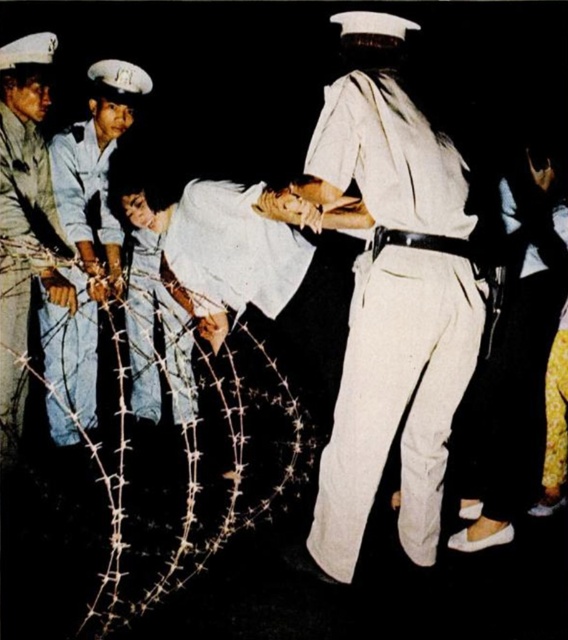
Who is taller, blue denim jeans at left or black leather belt at center?

blue denim jeans at left

Between blue denim jeans at left and black leather belt at center, which one appears on the left side from the viewer's perspective?

blue denim jeans at left

Measure the distance between point (48, 408) and camera.

Point (48, 408) and camera are 13.64 feet apart from each other.

You are a GUI agent. You are given a task and a screenshot of the screen. Output one action in this format:
    pyautogui.click(x=<x>, y=<y>)
    Task: Click on the blue denim jeans at left
    Image resolution: width=568 pixels, height=640 pixels.
    Given the screenshot: What is the action you would take?
    pyautogui.click(x=86, y=243)

Based on the photo, is white cotton uniform at center taller than blue denim jeans at left?

Yes, white cotton uniform at center is taller than blue denim jeans at left.

Can you confirm if white cotton uniform at center is positioned above blue denim jeans at left?

No.

Where is `white cotton uniform at center`? This screenshot has height=640, width=568. white cotton uniform at center is located at coordinates (395, 401).

Which is below, white cotton uniform at center or jeans at left?

white cotton uniform at center is below.

Who is more forward, (419, 486) or (19, 404)?

Positioned in front is point (419, 486).

The image size is (568, 640). Find the location of `white cotton uniform at center`. white cotton uniform at center is located at coordinates (395, 401).

Locate an element on the screen. white cotton uniform at center is located at coordinates (395, 401).